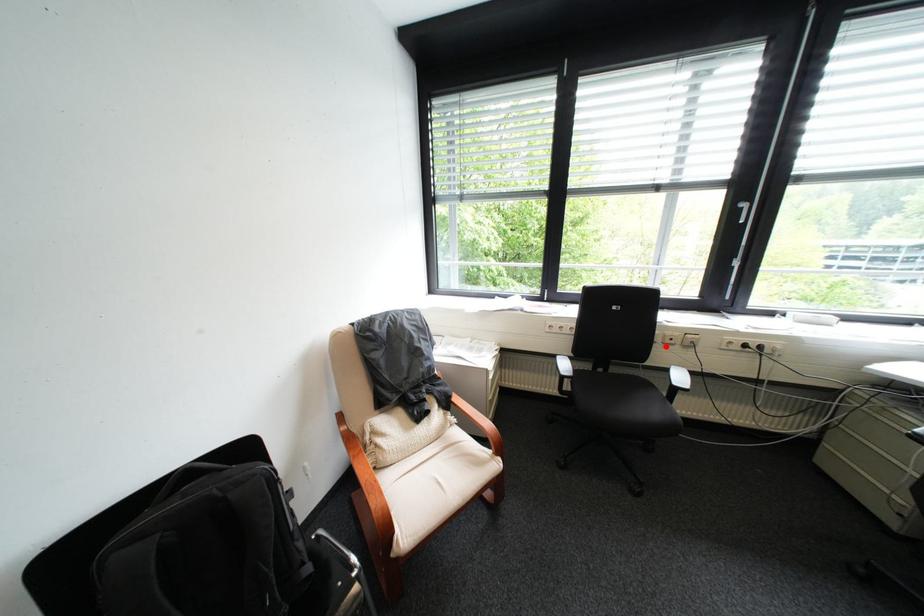
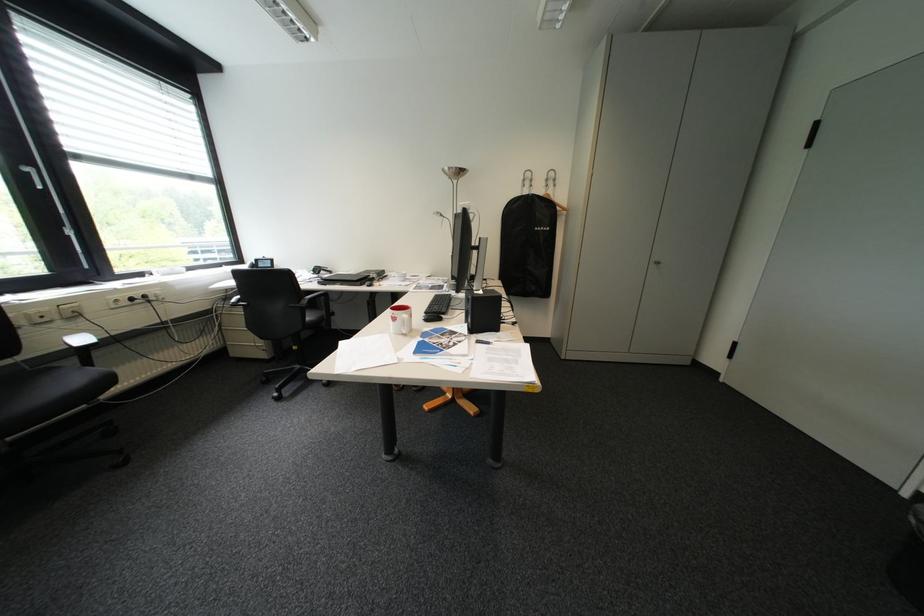
Question: I am providing you with two images of the same scene from different viewpoints. Given a red point in image1, look at the same physical point in image2. Is it:

Choices:
 (A) Closer to the viewpoint
 (B) Farther from the viewpoint

Answer: (B)